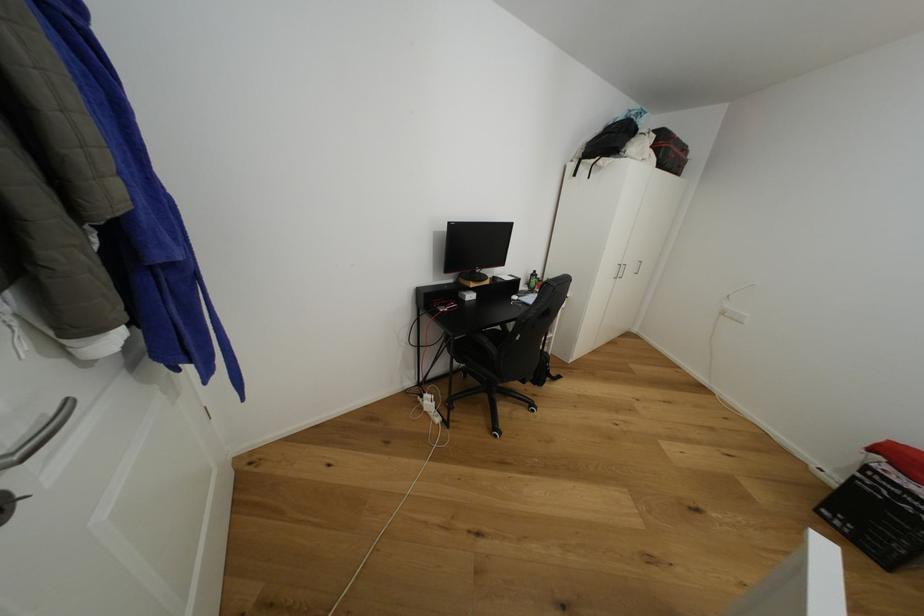
Identify the location of large black box. tap(877, 511).